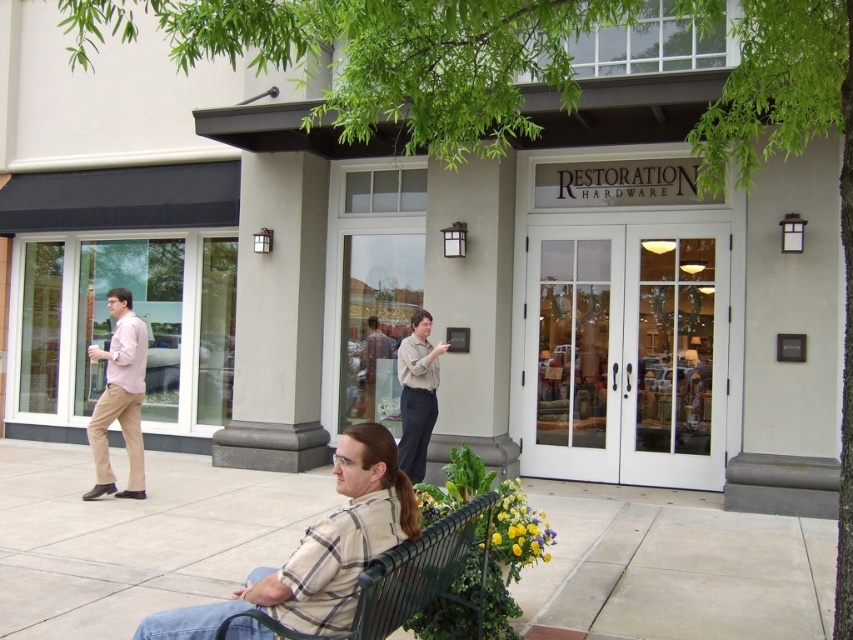
The width and height of the screenshot is (853, 640). Describe the element at coordinates (409, 577) in the screenshot. I see `green metal bench at lower center` at that location.

Who is more distant from viewer, (x=396, y=563) or (x=132, y=392)?

Point (x=132, y=392)

The width and height of the screenshot is (853, 640). I want to click on green metal bench at lower center, so click(x=409, y=577).

Between point (422, 340) and point (370, 416), which one is positioned in front?

Positioned in front is point (422, 340).

Which is below, light brown shirt at center or light brown leather jacket at center?

light brown shirt at center is lower down.

Which is behind, point (409, 376) or point (364, 344)?

The point (364, 344) is behind.

The image size is (853, 640). I want to click on light brown shirt at center, so coord(416,394).

Which is below, light pink shirt at left or light brown shirt at center?

light brown shirt at center

Does light pink shirt at left have a greater height compared to light brown shirt at center?

Yes.

The width and height of the screenshot is (853, 640). What do you see at coordinates (119, 397) in the screenshot?
I see `light pink shirt at left` at bounding box center [119, 397].

The width and height of the screenshot is (853, 640). What are the coordinates of `light pink shirt at left` in the screenshot? It's located at [119, 397].